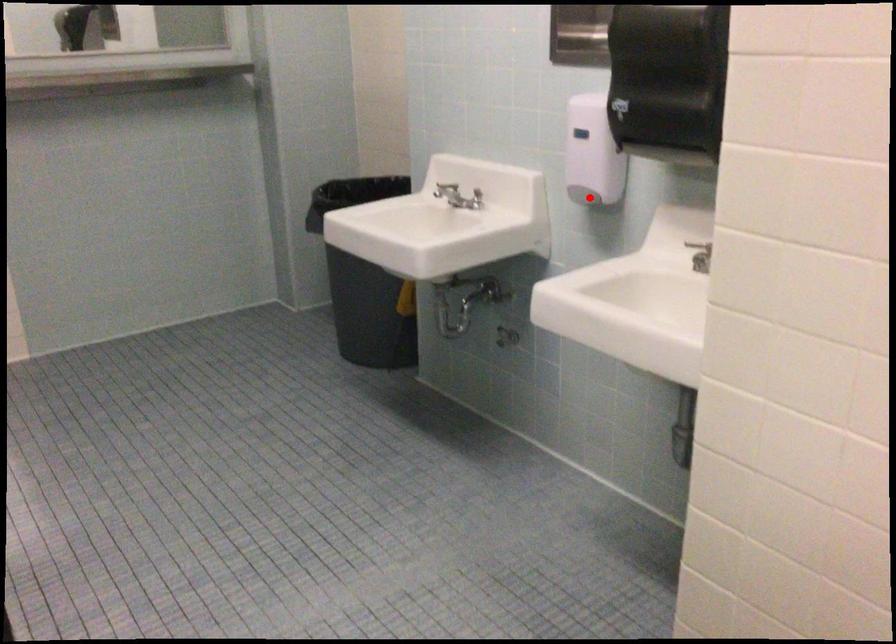
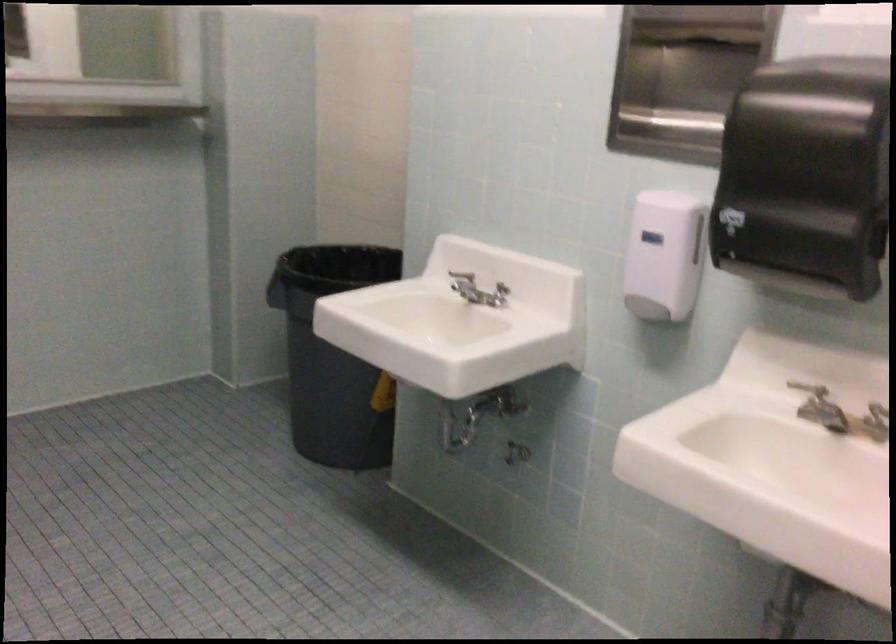
In the second image, find the point that corresponds to the highlighted location in the first image.

(653, 310)